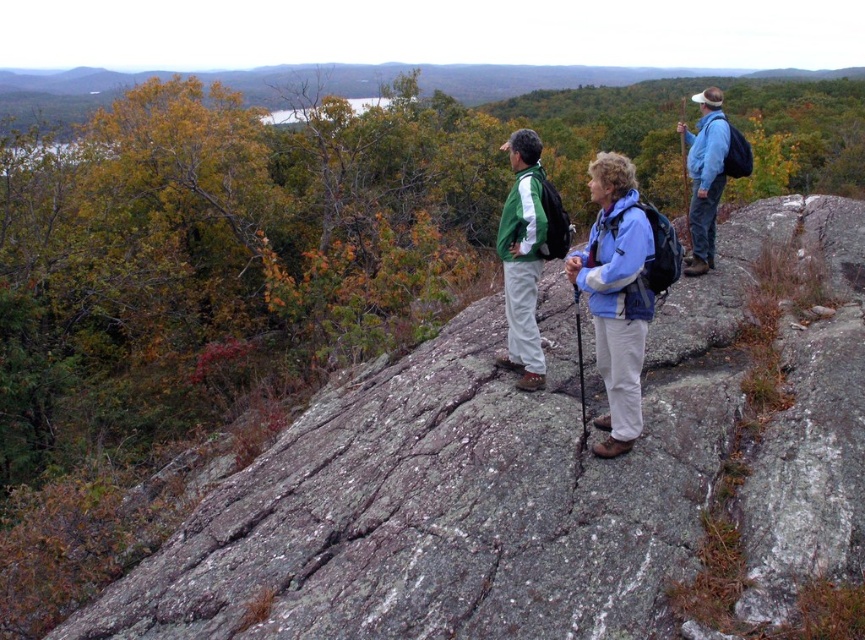
Can you confirm if gray rough rock at center is shorter than green fleece jacket at center?

Yes, gray rough rock at center is shorter than green fleece jacket at center.

Who is positioned more to the left, gray rough rock at center or green fleece jacket at center?

gray rough rock at center

Between point (537, 547) and point (516, 284), which one is positioned behind?

Point (516, 284)

Find the location of `gray rough rock at center`. gray rough rock at center is located at coordinates (530, 480).

Does matte blue jacket at center appear over blue fabric jacket at upper right?

Indeed, matte blue jacket at center is positioned over blue fabric jacket at upper right.

Is point (629, 419) less distant than point (718, 170)?

Yes, point (629, 419) is closer to viewer.

This screenshot has height=640, width=865. I want to click on matte blue jacket at center, so click(622, 289).

Is gray rough rock at center to the right of blue fabric jacket at center from the viewer's perspective?

In fact, gray rough rock at center is to the left of blue fabric jacket at center.

Does gray rough rock at center lie in front of blue fabric jacket at center?

Yes, gray rough rock at center is in front of blue fabric jacket at center.

Who is more distant from viewer, (811, 573) or (623, 412)?

The point (623, 412) is behind.

The width and height of the screenshot is (865, 640). I want to click on gray rough rock at center, so click(530, 480).